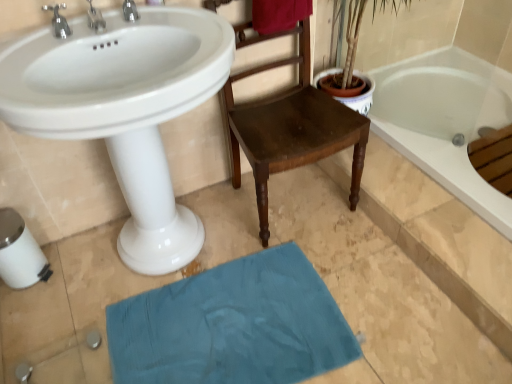
Question: Is white glossy sink at upper left to the left or to the right of wooden chair at center in the image?

Choices:
 (A) left
 (B) right

Answer: (A)

Question: From the image's perspective, is white glossy sink at upper left located above or below wooden chair at center?

Choices:
 (A) below
 (B) above

Answer: (A)

Question: Estimate the real-world distances between objects in this image. Which object is farther from the silver metallic faucet at upper left, the second tap in the right-to-left sequence?

Choices:
 (A) wooden chair at center
 (B) teal fabric bath mat at lower center
 (C) white plastic toilet paper at lower left
 (D) white glossy sink at upper left
 (E) velvet red towel at upper center

Answer: (B)

Question: Which is nearer to the velvet red towel at upper center?

Choices:
 (A) silver metallic faucet at upper left, the second tap in the right-to-left sequence
 (B) white glossy sink at upper left
 (C) silver metallic faucet at upper left, positioned as the 3th tap in right-to-left order
 (D) white plastic toilet paper at lower left
 (E) silver metallic tap at upper left, which ranks as the first tap in right-to-left order

Answer: (E)